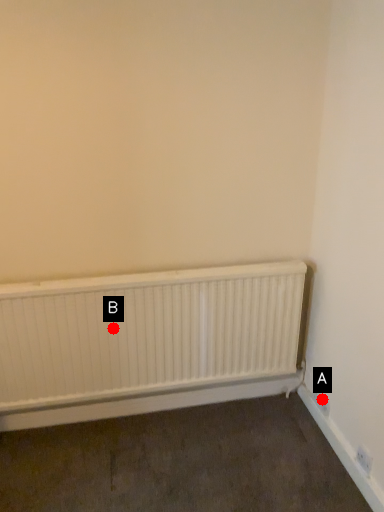
Question: Two points are circled on the image, labeled by A and B beside each circle. Which point appears farthest from the camera in this image?

Choices:
 (A) A is further
 (B) B is further

Answer: (A)